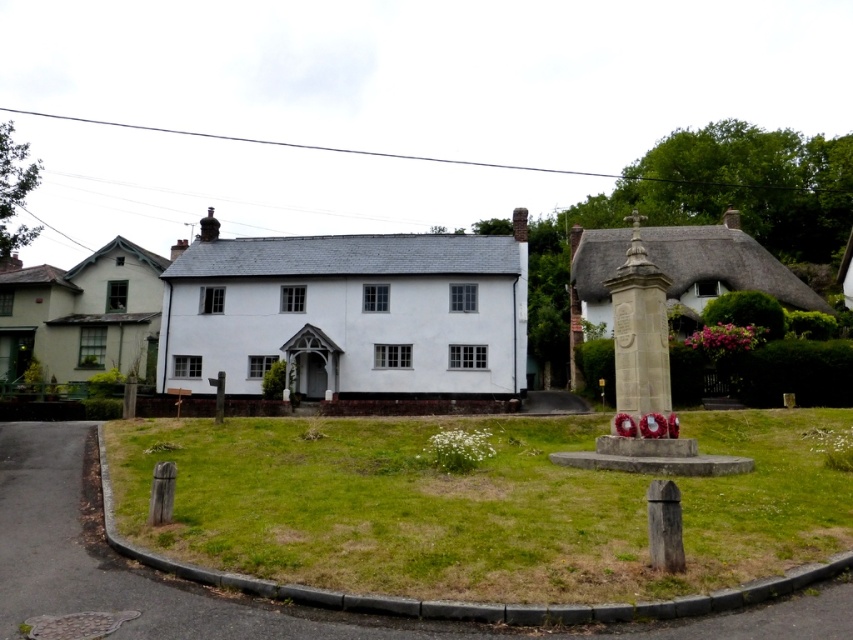
Does thatched roof cottage at right appear under wooden post at lower left?

Incorrect, thatched roof cottage at right is not positioned below wooden post at lower left.

Does thatched roof cottage at right have a greater height compared to wooden post at lower left?

Yes, thatched roof cottage at right is taller than wooden post at lower left.

Which is in front, point (724, 220) or point (173, 476)?

Point (173, 476) is more forward.

Identify the location of thatched roof cottage at right. This screenshot has height=640, width=853. (718, 268).

Who is lower down, thatched roof cottage at right or stone monument at center?

stone monument at center

Describe the element at coordinates (718, 268) in the screenshot. I see `thatched roof cottage at right` at that location.

Image resolution: width=853 pixels, height=640 pixels. In order to click on thatched roof cottage at right in this screenshot , I will do `click(718, 268)`.

Which is more to the left, white smooth cottage at center or wooden post at lower left?

From the viewer's perspective, white smooth cottage at center appears more on the left side.

Between point (230, 385) and point (149, 522), which one is positioned behind?

Positioned behind is point (230, 385).

This screenshot has width=853, height=640. What are the coordinates of `white smooth cottage at center` in the screenshot? It's located at (347, 312).